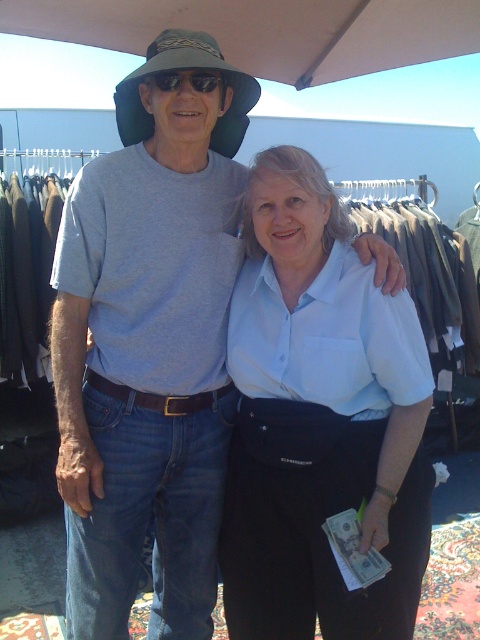
You are a customer at the market and see the white cotton blouse at center and the matte black sunglasses at upper center. Which item is located more to the right?

The white cotton blouse at center is more to the right than the matte black sunglasses at upper center.

You are a customer at the market stall and want to buy the green fabric hat at upper center. Which person should you approach to purchase it?

The green fabric hat at upper center is located at point (186, 68), which is closer to the man on the left wearing a gray t shirt and green hat. Therefore, you should approach the man on the left to purchase the green fabric hat at upper center.